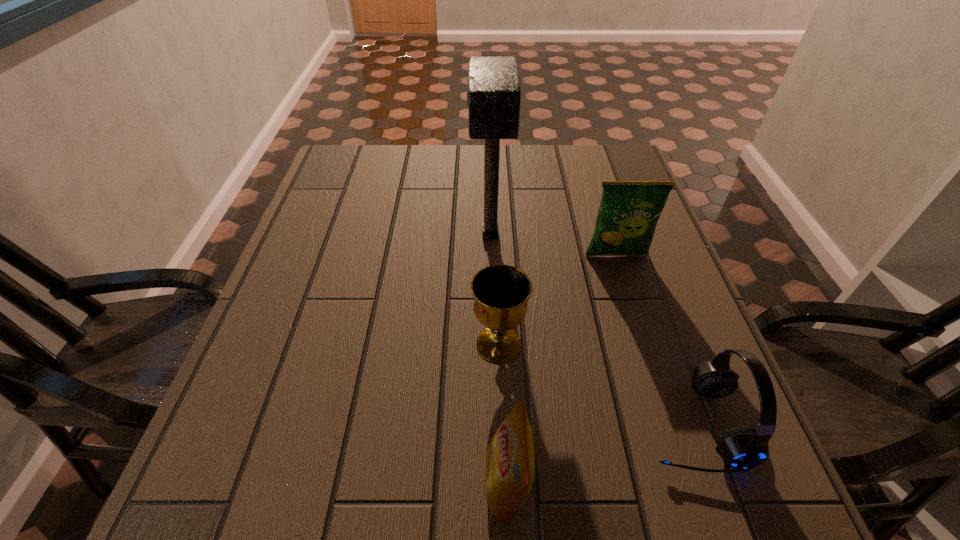
I want to click on the tallest object, so click(494, 85).

The height and width of the screenshot is (540, 960). I want to click on the farther crisp (potato chip), so click(629, 211).

The image size is (960, 540). Identify the location of the right crisp (potato chip). (629, 211).

You are a GUI agent. You are given a task and a screenshot of the screen. Output one action in this format:
    pyautogui.click(x=<x>, y=<y>)
    Task: Click on the third farthest object
    
    Given the screenshot: What is the action you would take?
    pyautogui.click(x=501, y=292)

Where is `headset`? The image size is (960, 540). headset is located at coordinates (740, 447).

This screenshot has height=540, width=960. In order to click on the nearer crisp (potato chip) in this screenshot , I will do `click(509, 459)`.

Locate an element on the screen. This screenshot has width=960, height=540. the left crisp (potato chip) is located at coordinates (509, 459).

At what (x,y) coordinates should I click in order to perform the action: click on free spot located on the right of the tallest object. Please return your answer as a coordinate pair (x, y). Looking at the image, I should click on (542, 234).

This screenshot has height=540, width=960. In order to click on vacant space located on the front-facing side of the right crisp (potato chip) in this screenshot , I will do `click(636, 320)`.

Image resolution: width=960 pixels, height=540 pixels. I want to click on vacant space located 0.170m on the front of the chalice, so click(x=502, y=455).